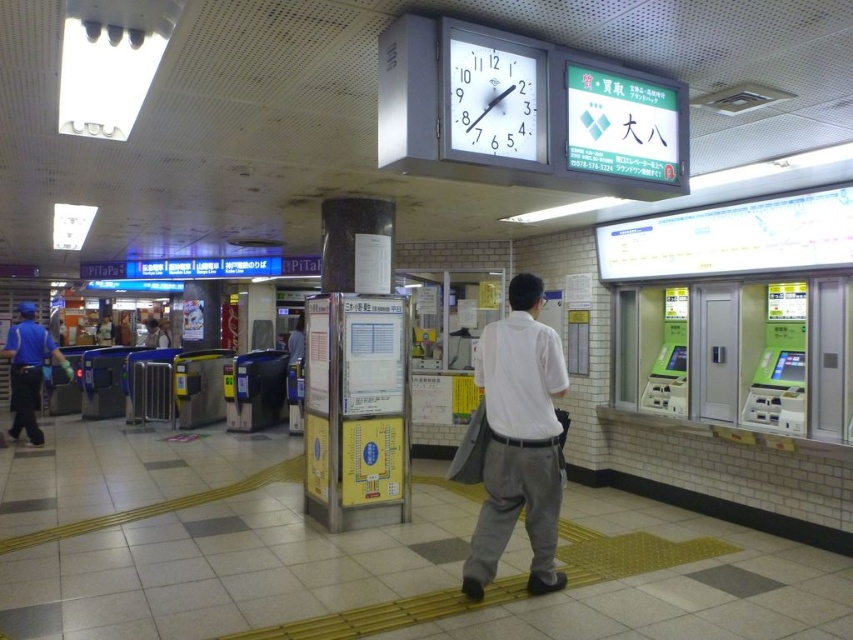
Which is above, white cotton shirt at center or blue uniform at left?

white cotton shirt at center is higher up.

Does white cotton shirt at center appear over blue uniform at left?

Indeed, white cotton shirt at center is positioned over blue uniform at left.

Between point (531, 456) and point (41, 332), which one is positioned in front?

Point (531, 456) is in front.

Locate an element on the screen. The height and width of the screenshot is (640, 853). white cotton shirt at center is located at coordinates (519, 440).

Is white glossy clock at upper center shorter than blue uniform at left?

Indeed, white glossy clock at upper center has a lesser height compared to blue uniform at left.

Does white glossy clock at upper center have a smaller size compared to blue uniform at left?

Correct, white glossy clock at upper center occupies less space than blue uniform at left.

Identify the location of white glossy clock at upper center. This screenshot has width=853, height=640. (494, 99).

Is the position of white cotton shirt at center more distant than that of white glossy clock at upper center?

Yes, it is behind white glossy clock at upper center.

Is point (511, 500) positioned behind point (543, 112)?

Yes.

What do you see at coordinates (519, 440) in the screenshot? The image size is (853, 640). I see `white cotton shirt at center` at bounding box center [519, 440].

I want to click on white cotton shirt at center, so click(519, 440).